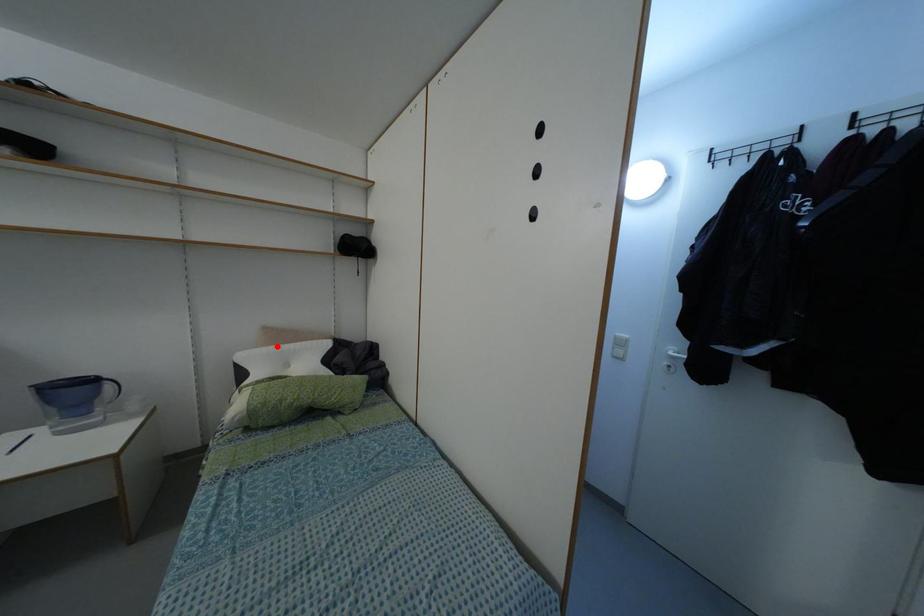
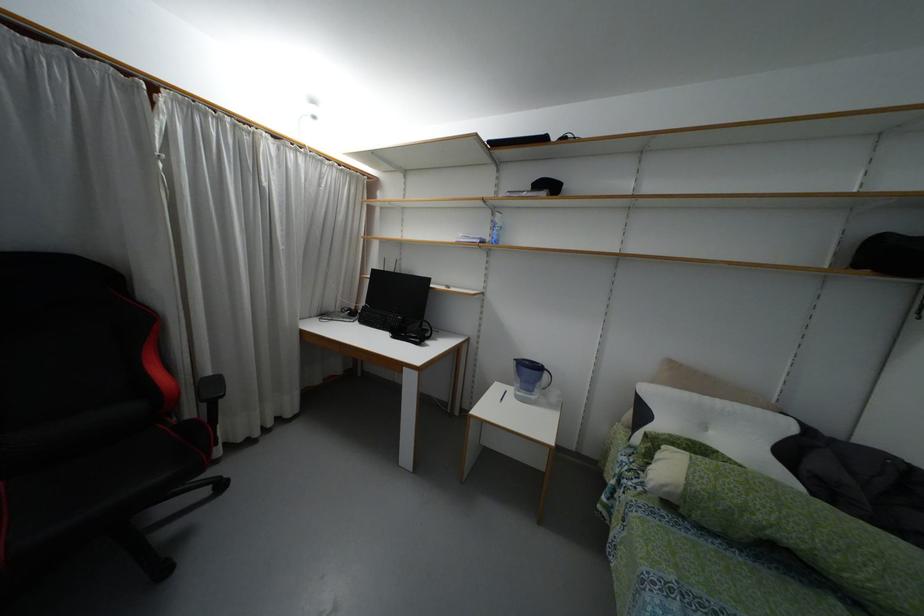
Find the pixel in the second image that matches the highlighted location in the first image.

(695, 395)